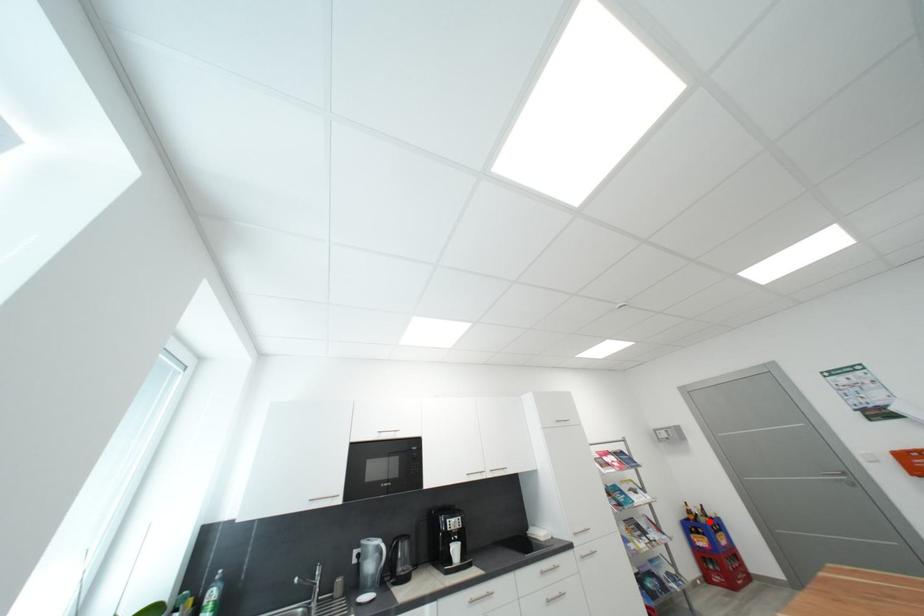
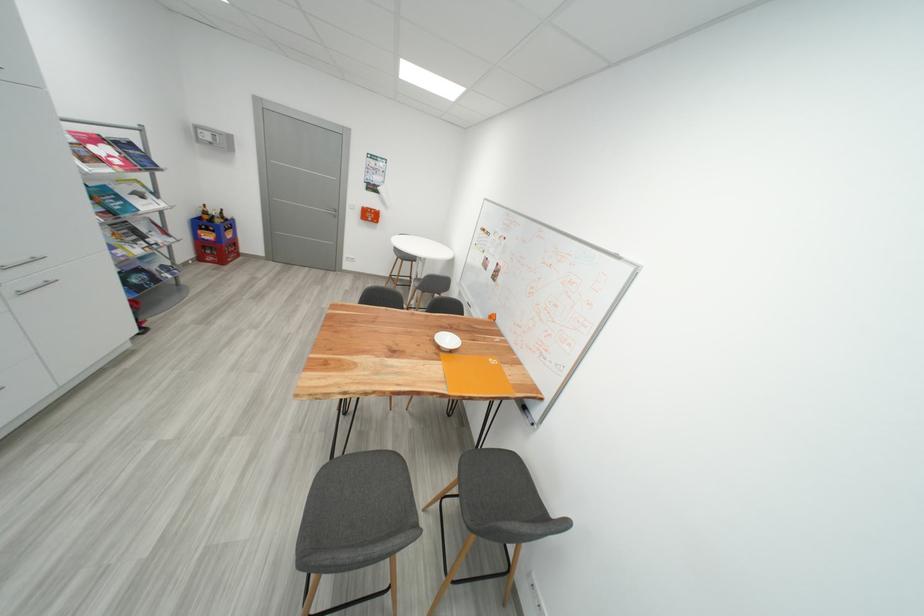
In the second image, find the point that corresponds to the highlighted location in the first image.

(225, 223)